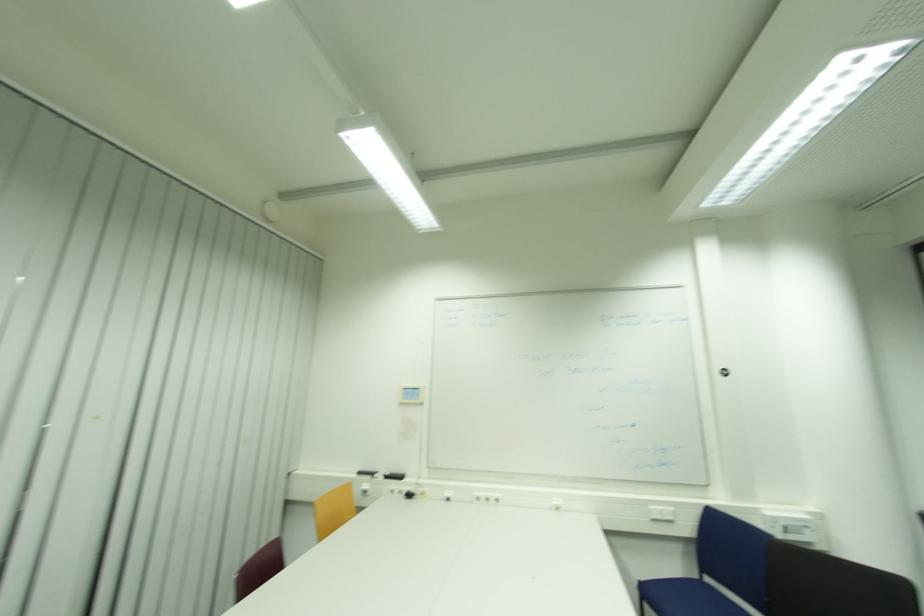
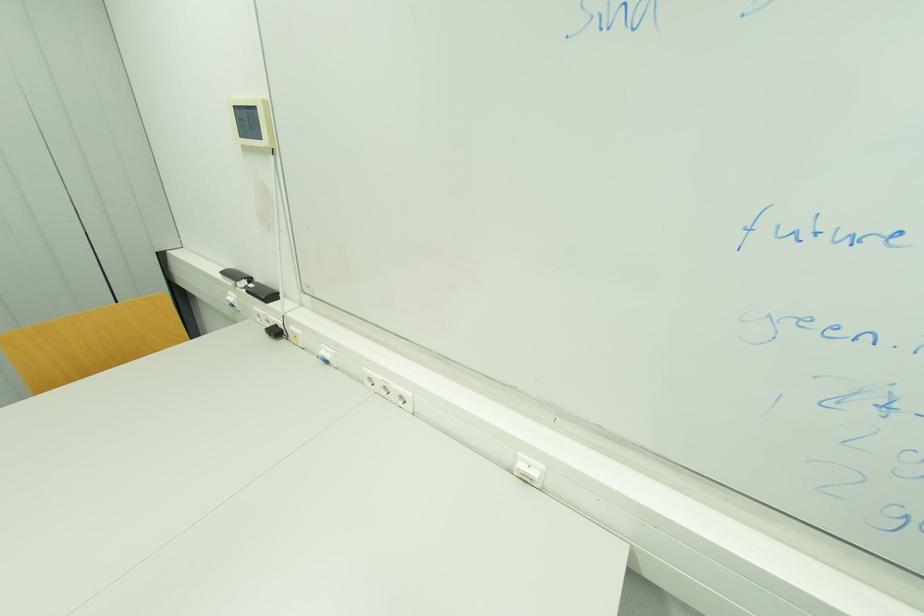
Find the pixel in the second image that matches (x=453, y=500) in the first image.

(330, 362)